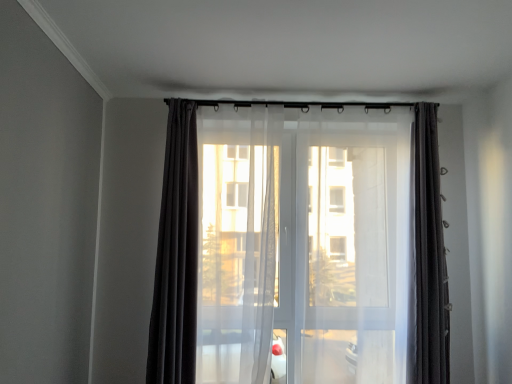
Describe the element at coordinates (176, 255) in the screenshot. I see `matte black curtain at center, acting as the first curtain starting from the left` at that location.

In order to face matte black curtain at center, the first curtain viewed from the right, should I rotate leftwards or rightwards?

Turn right approximately 21.656 degrees to face it.

What do you see at coordinates (426, 258) in the screenshot? This screenshot has height=384, width=512. I see `matte black curtain at center, which is the 3th curtain in left-to-right order` at bounding box center [426, 258].

The width and height of the screenshot is (512, 384). Find the location of `sheer white curtain at center, the 2th curtain when ordered from left to right`. sheer white curtain at center, the 2th curtain when ordered from left to right is located at coordinates (176, 255).

From a real-world perspective, is sheer white curtain at center, positioned as the 2th curtain in right-to-left order, positioned above or below transparent fabric screen door at center?

In terms of real-world spatial position, sheer white curtain at center, positioned as the 2th curtain in right-to-left order, is below transparent fabric screen door at center.

Between sheer white curtain at center, the 2th curtain when ordered from left to right, and transparent fabric screen door at center, which one appears on the right side from the viewer's perspective?

transparent fabric screen door at center is more to the right.

Between sheer white curtain at center, positioned as the 2th curtain in right-to-left order, and matte black curtain at center, which ranks as the third curtain in right-to-left order, which one has larger width?

matte black curtain at center, which ranks as the third curtain in right-to-left order, is wider.

Is sheer white curtain at center, the 2th curtain when ordered from left to right, outside of matte black curtain at center, which ranks as the third curtain in right-to-left order?

Yes.

Which object is positioned more to the right, sheer white curtain at center, the 2th curtain when ordered from left to right, or matte black curtain at center, which ranks as the third curtain in right-to-left order?

sheer white curtain at center, the 2th curtain when ordered from left to right.

Is sheer white curtain at center, positioned as the 2th curtain in right-to-left order, positioned behind matte black curtain at center, which ranks as the third curtain in right-to-left order?

Yes, the depth of sheer white curtain at center, positioned as the 2th curtain in right-to-left order, is greater than that of matte black curtain at center, which ranks as the third curtain in right-to-left order.

From the picture: Is transparent fabric screen door at center looking in the opposite direction of matte black curtain at center, which ranks as the third curtain in right-to-left order?

No, matte black curtain at center, which ranks as the third curtain in right-to-left order, is not at the back of transparent fabric screen door at center.

Which is more to the right, transparent fabric screen door at center or matte black curtain at center, acting as the first curtain starting from the left?

From the viewer's perspective, transparent fabric screen door at center appears more on the right side.

How different are the orientations of transparent fabric screen door at center and matte black curtain at center, acting as the first curtain starting from the left, in degrees?

There is a 8.95e-06-degree angle between the facing directions of transparent fabric screen door at center and matte black curtain at center, acting as the first curtain starting from the left.

Does matte black curtain at center, which is the 3th curtain in left-to-right order, touch sheer white curtain at center, the 2th curtain when ordered from left to right?

No, matte black curtain at center, which is the 3th curtain in left-to-right order, is not next to sheer white curtain at center, the 2th curtain when ordered from left to right.

Is matte black curtain at center, which is the 3th curtain in left-to-right order, facing towards sheer white curtain at center, positioned as the 2th curtain in right-to-left order?

No.

Is matte black curtain at center, the first curtain viewed from the right, shorter than sheer white curtain at center, the 2th curtain when ordered from left to right?

Yes, matte black curtain at center, the first curtain viewed from the right, is shorter than sheer white curtain at center, the 2th curtain when ordered from left to right.

Between matte black curtain at center, the first curtain viewed from the right, and sheer white curtain at center, positioned as the 2th curtain in right-to-left order, which one has smaller size?

With smaller size is matte black curtain at center, the first curtain viewed from the right.

Is matte black curtain at center, acting as the first curtain starting from the left, to the left of transparent fabric screen door at center from the viewer's perspective?

Indeed, matte black curtain at center, acting as the first curtain starting from the left, is positioned on the left side of transparent fabric screen door at center.

Considering the sizes of objects matte black curtain at center, acting as the first curtain starting from the left, and transparent fabric screen door at center in the image provided, who is taller, matte black curtain at center, acting as the first curtain starting from the left, or transparent fabric screen door at center?

transparent fabric screen door at center.

Considering the relative sizes of matte black curtain at center, acting as the first curtain starting from the left, and transparent fabric screen door at center in the image provided, is matte black curtain at center, acting as the first curtain starting from the left, smaller than transparent fabric screen door at center?

Correct, matte black curtain at center, acting as the first curtain starting from the left, occupies less space than transparent fabric screen door at center.

Which object is closer to the camera, sheer white curtain at center, the 2th curtain when ordered from left to right, or matte black curtain at center, the first curtain viewed from the right?

Positioned in front is matte black curtain at center, the first curtain viewed from the right.

Between point (167, 281) and point (432, 363), which one is positioned in front?

Point (167, 281)

Is sheer white curtain at center, the 2th curtain when ordered from left to right, looking in the opposite direction of matte black curtain at center, which is the 3th curtain in left-to-right order?

No, sheer white curtain at center, the 2th curtain when ordered from left to right,'s orientation is not away from matte black curtain at center, which is the 3th curtain in left-to-right order.

From a real-world perspective, between sheer white curtain at center, positioned as the 2th curtain in right-to-left order, and matte black curtain at center, the first curtain viewed from the right, who is vertically lower?

From a 3D spatial view, sheer white curtain at center, positioned as the 2th curtain in right-to-left order, is below.

Is transparent fabric screen door at center bigger than matte black curtain at center, the first curtain viewed from the right?

Correct, transparent fabric screen door at center is larger in size than matte black curtain at center, the first curtain viewed from the right.

Would you say transparent fabric screen door at center is inside or outside matte black curtain at center, the first curtain viewed from the right?

transparent fabric screen door at center is not enclosed by matte black curtain at center, the first curtain viewed from the right.

Can you confirm if transparent fabric screen door at center is taller than matte black curtain at center, the first curtain viewed from the right?

Indeed, transparent fabric screen door at center has a greater height compared to matte black curtain at center, the first curtain viewed from the right.

Identify the location of curtain that is below the transparent fabric screen door at center (from the image's perspective). The image size is (512, 384). (176, 255).

You are a GUI agent. You are given a task and a screenshot of the screen. Output one action in this format:
    pyautogui.click(x=<x>, y=<y>)
    Task: Click on the 1st curtain counting from the right of the matte black curtain at center, acting as the first curtain starting from the left
    Image resolution: width=512 pixels, height=384 pixels.
    Given the screenshot: What is the action you would take?
    pyautogui.click(x=176, y=255)

When comparing their distances from matte black curtain at center, which ranks as the third curtain in right-to-left order, does matte black curtain at center, the first curtain viewed from the right, or sheer white curtain at center, the 2th curtain when ordered from left to right, seem closer?

sheer white curtain at center, the 2th curtain when ordered from left to right, is positioned closer to the anchor matte black curtain at center, which ranks as the third curtain in right-to-left order.

Which object lies nearer to the anchor point matte black curtain at center, acting as the first curtain starting from the left, matte black curtain at center, the first curtain viewed from the right, or transparent fabric screen door at center?

transparent fabric screen door at center is closer to matte black curtain at center, acting as the first curtain starting from the left.

Estimate the real-world distances between objects in this image. Which object is further from matte black curtain at center, which is the 3th curtain in left-to-right order, matte black curtain at center, acting as the first curtain starting from the left, or transparent fabric screen door at center?

Among the two, matte black curtain at center, acting as the first curtain starting from the left, is located further to matte black curtain at center, which is the 3th curtain in left-to-right order.

Looking at the image, which one is located further to transparent fabric screen door at center, sheer white curtain at center, positioned as the 2th curtain in right-to-left order, or matte black curtain at center, which is the 3th curtain in left-to-right order?

sheer white curtain at center, positioned as the 2th curtain in right-to-left order, is further to transparent fabric screen door at center.

Considering their positions, is sheer white curtain at center, positioned as the 2th curtain in right-to-left order, positioned closer to transparent fabric screen door at center than matte black curtain at center, which ranks as the third curtain in right-to-left order?

The object closer to transparent fabric screen door at center is matte black curtain at center, which ranks as the third curtain in right-to-left order.

Which object lies further to the anchor point sheer white curtain at center, positioned as the 2th curtain in right-to-left order, matte black curtain at center, acting as the first curtain starting from the left, or matte black curtain at center, which is the 3th curtain in left-to-right order?

matte black curtain at center, which is the 3th curtain in left-to-right order.

Looking at the image, which one is located further to transparent fabric screen door at center, matte black curtain at center, acting as the first curtain starting from the left, or matte black curtain at center, which is the 3th curtain in left-to-right order?

matte black curtain at center, acting as the first curtain starting from the left, is further to transparent fabric screen door at center.

Which object lies nearer to the anchor point matte black curtain at center, which is the 3th curtain in left-to-right order, matte black curtain at center, which ranks as the third curtain in right-to-left order, or sheer white curtain at center, positioned as the 2th curtain in right-to-left order?

Based on the image, matte black curtain at center, which ranks as the third curtain in right-to-left order, appears to be nearer to matte black curtain at center, which is the 3th curtain in left-to-right order.

The width and height of the screenshot is (512, 384). I want to click on curtain between matte black curtain at center, which ranks as the third curtain in right-to-left order, and transparent fabric screen door at center, in the horizontal direction, so click(176, 255).

Locate an element on the screen. The width and height of the screenshot is (512, 384). screen door between matte black curtain at center, acting as the first curtain starting from the left, and matte black curtain at center, the first curtain viewed from the right, in the horizontal direction is located at coordinates (350, 266).

Identify the location of screen door between sheer white curtain at center, the 2th curtain when ordered from left to right, and matte black curtain at center, the first curtain viewed from the right, from left to right. (350, 266).

This screenshot has height=384, width=512. Find the location of `curtain between matte black curtain at center, which ranks as the third curtain in right-to-left order, and matte black curtain at center, which is the 3th curtain in left-to-right order`. curtain between matte black curtain at center, which ranks as the third curtain in right-to-left order, and matte black curtain at center, which is the 3th curtain in left-to-right order is located at coordinates (176, 255).